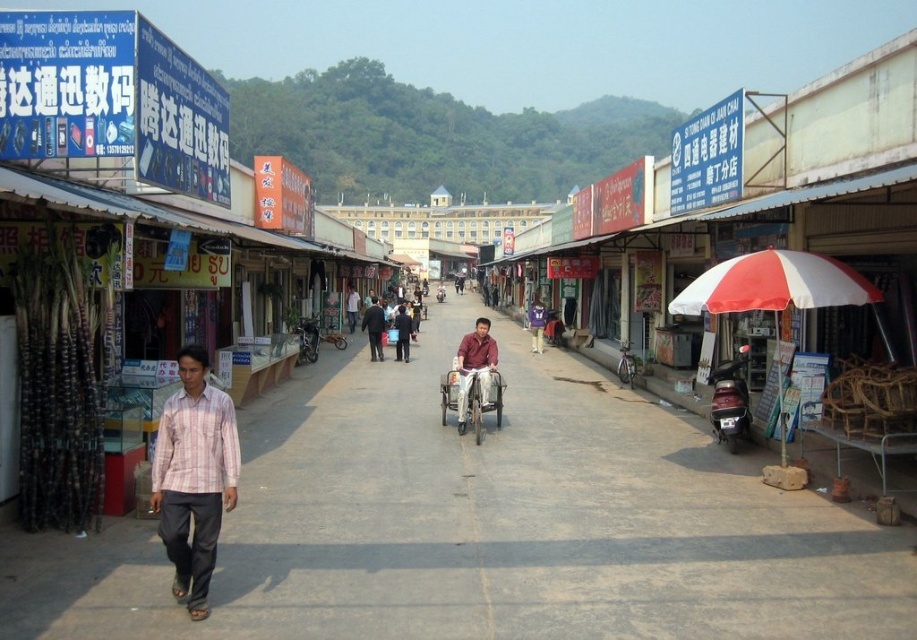
Question: Does matte red shirt at center have a larger size compared to dark gray pants at center?

Choices:
 (A) yes
 (B) no

Answer: (B)

Question: Does red/white striped umbrella at right appear over light brown shirt at center?

Choices:
 (A) yes
 (B) no

Answer: (B)

Question: Which is farther from the red/white striped umbrella at right?

Choices:
 (A) dark brown leather jacket at center
 (B) pink plaid shirt at left

Answer: (A)

Question: Among these objects, which one is nearest to the camera?

Choices:
 (A) light brown shirt at center
 (B) dark gray pants at center
 (C) matte red shirt at center
 (D) purple fabric shirt at center

Answer: (C)

Question: Does dark gray pants at center appear over purple fabric shirt at center?

Choices:
 (A) yes
 (B) no

Answer: (B)

Question: Which object appears closest to the camera in this image?

Choices:
 (A) dark gray pants at center
 (B) matte red shirt at center

Answer: (B)